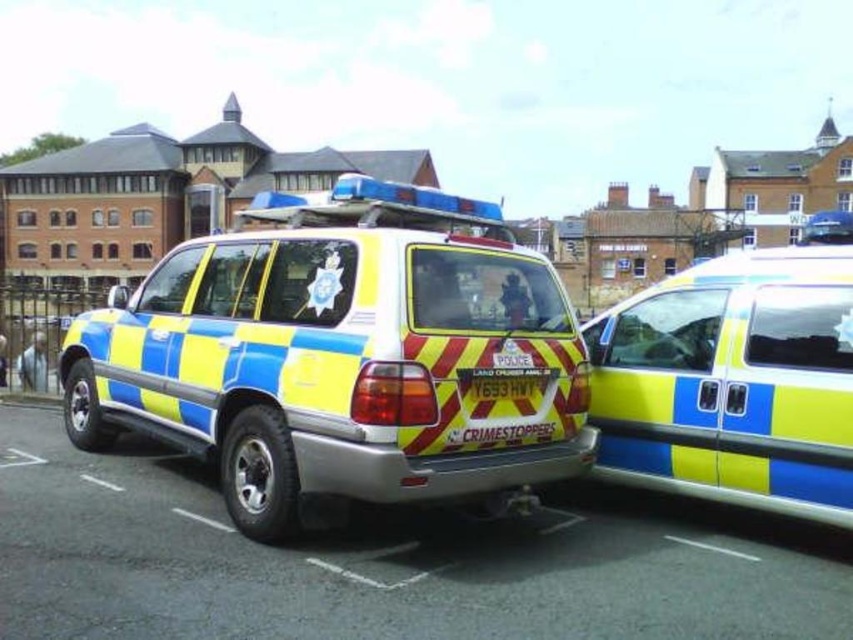
You are a delivery driver who needs to park your van in a parking lot. There is a blue and yellow striped police vehicle at center. Based on the coordinates provided, where should you park your van to avoid blocking the police vehicle?

The blue and yellow striped police vehicle at center is located at coordinates point (341, 355). To avoid blocking it, park your van in an area not overlapping with these coordinates.

You are a parking attendant who needs to ensure that vehicles are parked at least 5 meters apart for safety reasons. You observe the blue and yellow striped police vehicle at center and the yellow and blue striped police vehicle at right in the image. Are these two vehicles parked safely according to the required distance?

The distance between the blue and yellow striped police vehicle at center and the yellow and blue striped police vehicle at right is 4.90 meters. Since the required distance is 5 meters, the vehicles are parked too close and do not meet the safety requirement.

You are a pedestrian standing in front of the two police vehicles. You want to walk to the yellow and blue striped police vehicle at right without crossing in front of the blue and yellow striped police vehicle at center. Is there a way to do this?

The blue and yellow striped police vehicle at center is positioned on the left side of the yellow and blue striped police vehicle at right. Therefore, you can walk around the right side of the blue and yellow striped police vehicle at center to reach the yellow and blue striped police vehicle at right without crossing in front of it.